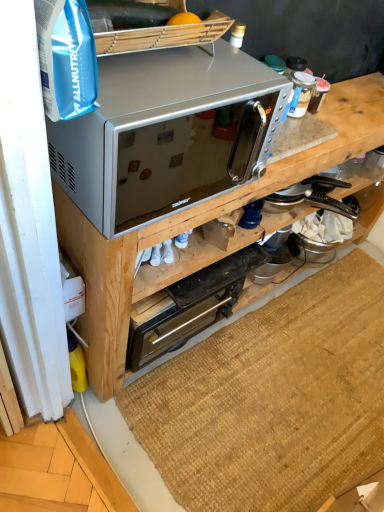
Question: Is satin silver microwave at upper center closer to the viewer compared to brown woven mat at lower center?

Choices:
 (A) no
 (B) yes

Answer: (B)

Question: Is satin silver microwave at upper center at the left side of brown woven mat at lower center?

Choices:
 (A) no
 (B) yes

Answer: (B)

Question: From the image's perspective, is satin silver microwave at upper center on brown woven mat at lower center?

Choices:
 (A) yes
 (B) no

Answer: (A)

Question: Is satin silver microwave at upper center not within brown woven mat at lower center?

Choices:
 (A) no
 (B) yes

Answer: (B)

Question: Considering the relative sizes of satin silver microwave at upper center and brown woven mat at lower center in the image provided, is satin silver microwave at upper center shorter than brown woven mat at lower center?

Choices:
 (A) no
 (B) yes

Answer: (A)

Question: Is metallic stainless steel toaster oven at center inside the boundaries of brown woven mat at lower center, or outside?

Choices:
 (A) inside
 (B) outside

Answer: (B)

Question: Is point (216, 317) positioned closer to the camera than point (301, 407)?

Choices:
 (A) closer
 (B) farther

Answer: (B)

Question: Considering the positions of metallic stainless steel toaster oven at center and brown woven mat at lower center in the image, is metallic stainless steel toaster oven at center taller or shorter than brown woven mat at lower center?

Choices:
 (A) tall
 (B) short

Answer: (A)

Question: From a real-world perspective, is metallic stainless steel toaster oven at center above or below brown woven mat at lower center?

Choices:
 (A) above
 (B) below

Answer: (A)

Question: Do you think brown woven mat at lower center is within satin silver microwave at upper center, or outside of it?

Choices:
 (A) outside
 (B) inside

Answer: (A)

Question: In the image, is brown woven mat at lower center positioned in front of or behind satin silver microwave at upper center?

Choices:
 (A) front
 (B) behind

Answer: (B)

Question: In terms of width, does brown woven mat at lower center look wider or thinner when compared to satin silver microwave at upper center?

Choices:
 (A) wide
 (B) thin

Answer: (A)

Question: Is brown woven mat at lower center taller or shorter than satin silver microwave at upper center?

Choices:
 (A) short
 (B) tall

Answer: (A)

Question: From the image's perspective, is satin silver microwave at upper center above or below silver metallic microwave at upper center?

Choices:
 (A) below
 (B) above

Answer: (B)

Question: In terms of height, does satin silver microwave at upper center look taller or shorter compared to silver metallic microwave at upper center?

Choices:
 (A) short
 (B) tall

Answer: (A)